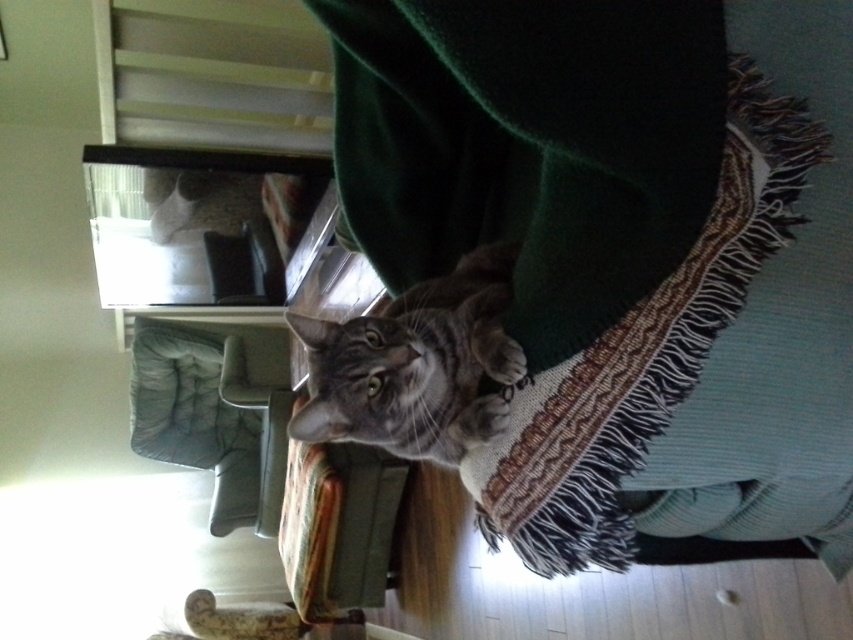
You are organizing a small event and need to determine seating arrangements. You have a velvet green blanket at center and a matte gray chair at lower left. Which object can accommodate more people sitting on it?

The velvet green blanket at center is larger in size than the matte gray chair at lower left, so it can accommodate more people sitting on it.